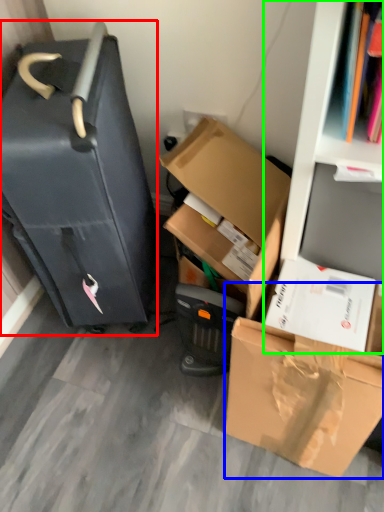
Question: Which object is positioned closest to suitcase (highlighted by a red box)? Select from box (highlighted by a blue box) and bookshelf (highlighted by a green box).

Choices:
 (A) box
 (B) bookshelf

Answer: (B)